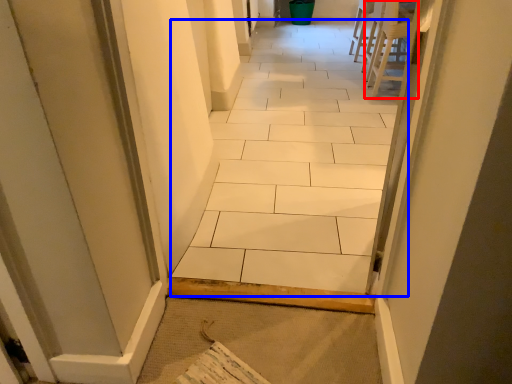
Question: Which object is further to the camera taking this photo, chair (highlighted by a red box) or ceramic tile (highlighted by a blue box)?

Choices:
 (A) chair
 (B) ceramic tile

Answer: (A)